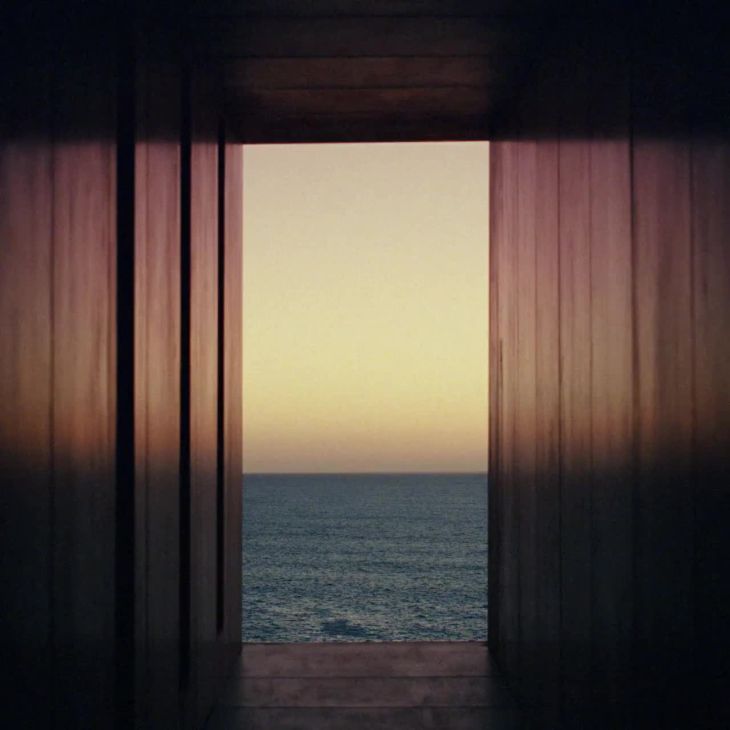
Where is `floor`? The image size is (730, 730). floor is located at coordinates (374, 715).